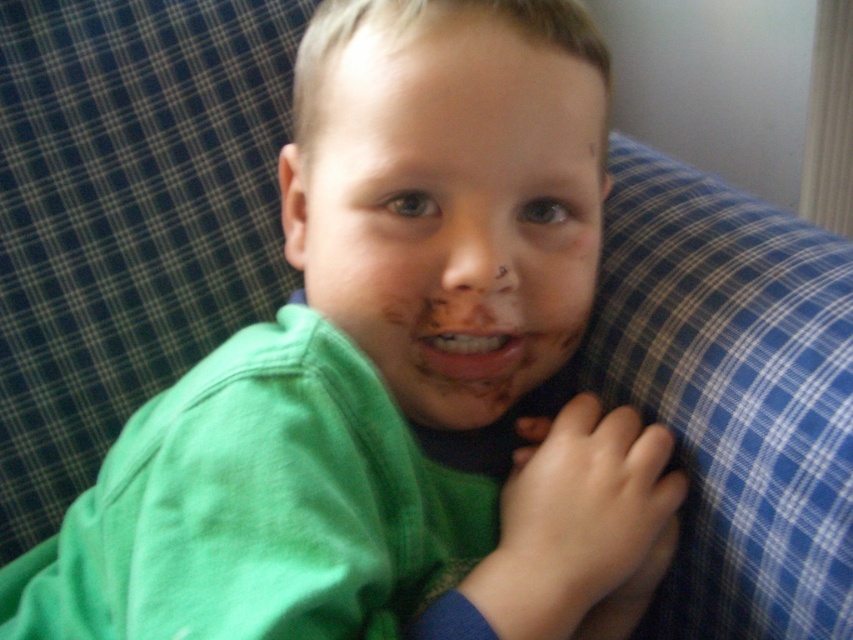
Can you confirm if chocolate matte face at center is positioned to the left of smooth chocolate mouth at center?

Correct, you'll find chocolate matte face at center to the left of smooth chocolate mouth at center.

Between point (444, 211) and point (520, 339), which one is positioned in front?

Point (444, 211) is in front.

You are a GUI agent. You are given a task and a screenshot of the screen. Output one action in this format:
    pyautogui.click(x=<x>, y=<y>)
    Task: Click on the chocolate matte face at center
    
    Given the screenshot: What is the action you would take?
    [x=451, y=209]